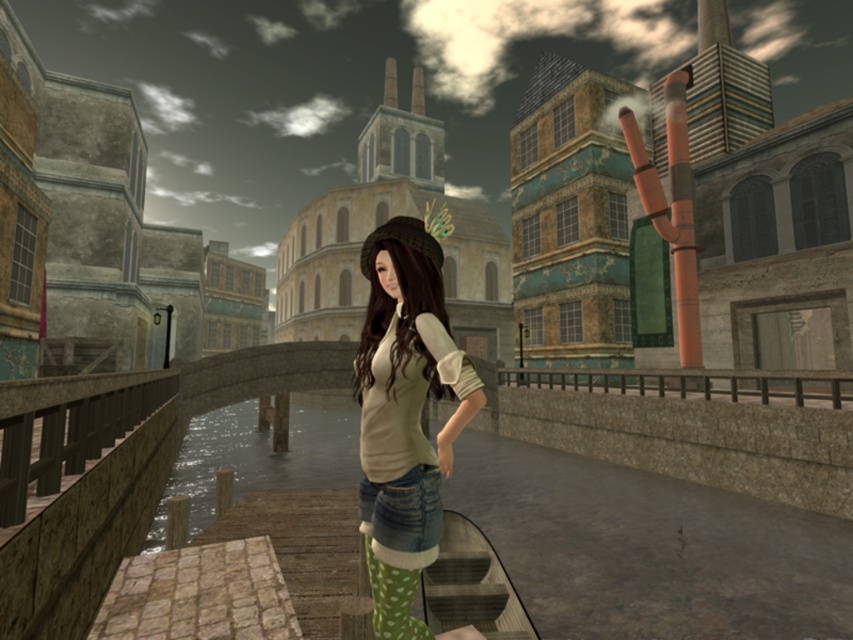
Consider the image. Who is shorter, matte green boots at center or clear water at dock center?

matte green boots at center is shorter.

Which is in front, point (469, 628) or point (312, 474)?

Point (469, 628)

In order to click on matte green boots at center in this screenshot , I will do `click(405, 413)`.

Find the location of `matte green boots at center`. matte green boots at center is located at coordinates (405, 413).

Is matte green boots at center to the right of brown wooden rail at right from the viewer's perspective?

No, matte green boots at center is not to the right of brown wooden rail at right.

Where is `matte green boots at center`? matte green boots at center is located at coordinates (405, 413).

Does clear water at dock center have a lesser width compared to brown wooden rail at right?

No, clear water at dock center is not thinner than brown wooden rail at right.

Does clear water at dock center have a smaller size compared to brown wooden rail at right?

Actually, clear water at dock center might be larger than brown wooden rail at right.

Is point (196, 506) farther from viewer compared to point (813, 387)?

No, it is in front of (813, 387).

Image resolution: width=853 pixels, height=640 pixels. I want to click on clear water at dock center, so click(x=257, y=458).